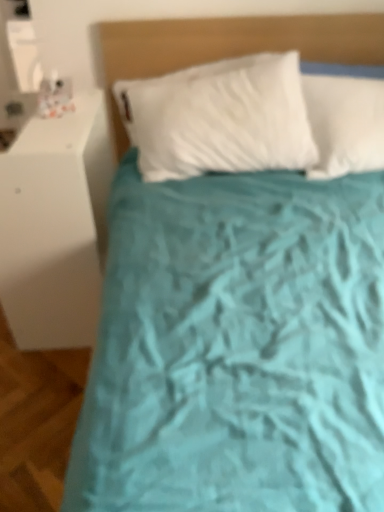
Question: Should I look upward or downward to see white matte dresser at left?

Choices:
 (A) up
 (B) down

Answer: (A)